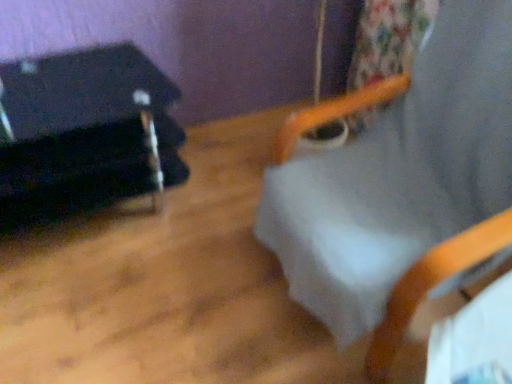
Question: Considering the relative positions of white fabric beach chair at upper center and black fabric at left in the image provided, is white fabric beach chair at upper center to the left or to the right of black fabric at left?

Choices:
 (A) right
 (B) left

Answer: (A)

Question: From the image's perspective, relative to black fabric at left, is white fabric beach chair at upper center above or below?

Choices:
 (A) above
 (B) below

Answer: (B)

Question: Do you think white fabric beach chair at upper center is within black fabric at left, or outside of it?

Choices:
 (A) inside
 (B) outside

Answer: (B)

Question: Considering the relative positions of black fabric at left and white fabric beach chair at upper center in the image provided, is black fabric at left to the left or to the right of white fabric beach chair at upper center?

Choices:
 (A) right
 (B) left

Answer: (B)

Question: Is black fabric at left wider or thinner than white fabric beach chair at upper center?

Choices:
 (A) wide
 (B) thin

Answer: (B)

Question: From a real-world perspective, is black fabric at left positioned above or below white fabric beach chair at upper center?

Choices:
 (A) above
 (B) below

Answer: (B)

Question: In terms of height, does black fabric at left look taller or shorter compared to white fabric beach chair at upper center?

Choices:
 (A) tall
 (B) short

Answer: (B)